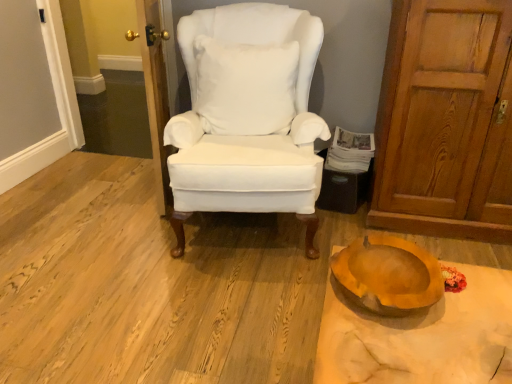
Question: Is the depth of white fluffy pillow at center less than that of wooden door at left, the 1th door positioned from the left?

Choices:
 (A) no
 (B) yes

Answer: (A)

Question: Considering the relative sizes of white fluffy pillow at center and wooden door at left, the 1th door positioned from the left, in the image provided, is white fluffy pillow at center shorter than wooden door at left, the 1th door positioned from the left,?

Choices:
 (A) no
 (B) yes

Answer: (B)

Question: From the image's perspective, is white fluffy pillow at center above wooden door at left, which is counted as the second door, starting from the right?

Choices:
 (A) no
 (B) yes

Answer: (B)

Question: Is white fluffy pillow at center in contact with wooden door at left, the 1th door positioned from the left?

Choices:
 (A) no
 (B) yes

Answer: (A)

Question: From a real-world perspective, is white fluffy pillow at center on top of wooden door at left, the 1th door positioned from the left?

Choices:
 (A) yes
 (B) no

Answer: (A)

Question: Based on their positions, is wooden bowl at lower right located to the left or right of matte orange bowl at lower right?

Choices:
 (A) left
 (B) right

Answer: (B)

Question: Looking at their shapes, would you say wooden bowl at lower right is wider or thinner than matte orange bowl at lower right?

Choices:
 (A) wide
 (B) thin

Answer: (A)

Question: From a real-world perspective, is wooden bowl at lower right positioned above or below matte orange bowl at lower right?

Choices:
 (A) below
 (B) above

Answer: (A)

Question: Is wooden bowl at lower right bigger or smaller than matte orange bowl at lower right?

Choices:
 (A) big
 (B) small

Answer: (A)

Question: Considering their positions, is wooden door at left, the 1th door positioned from the left, located in front of or behind white paper magazine at right?

Choices:
 (A) behind
 (B) front

Answer: (B)

Question: Is wooden door at left, which is counted as the second door, starting from the right, taller or shorter than white paper magazine at right?

Choices:
 (A) tall
 (B) short

Answer: (A)

Question: Considering the positions of point (165, 91) and point (352, 140), is point (165, 91) closer or farther from the camera than point (352, 140)?

Choices:
 (A) farther
 (B) closer

Answer: (B)

Question: Looking at the image, does wooden door at left, the 1th door positioned from the left, seem bigger or smaller compared to white paper magazine at right?

Choices:
 (A) big
 (B) small

Answer: (A)

Question: In the image, is wooden door at left, which is counted as the second door, starting from the right, on the left side or the right side of wooden door at right, the second door positioned from the left?

Choices:
 (A) right
 (B) left

Answer: (B)

Question: Does point (166, 97) appear closer or farther from the camera than point (480, 125)?

Choices:
 (A) closer
 (B) farther

Answer: (B)